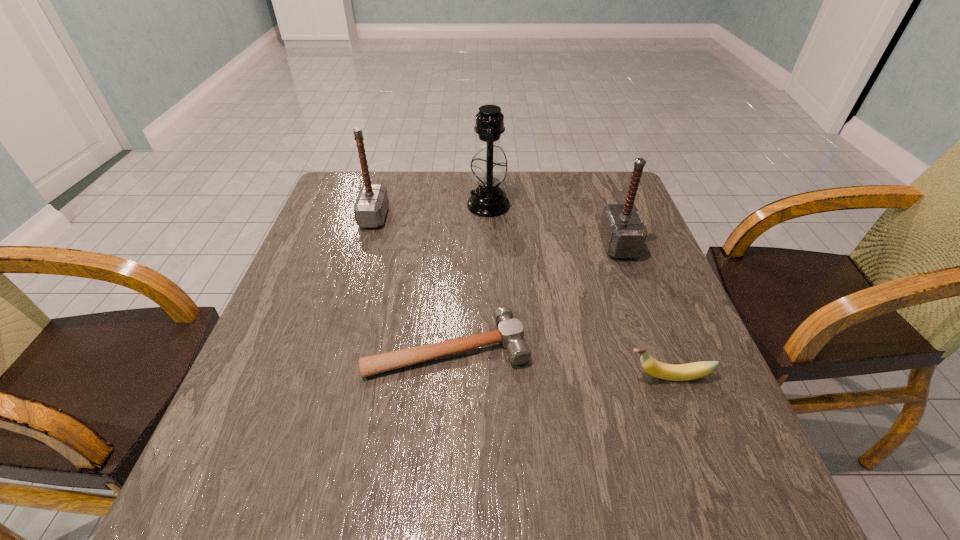
At what (x,y) coordinates should I click in order to perform the action: click on free space located 0.160m at the stem of the banana. Please return your answer as a coordinate pair (x, y). This screenshot has height=540, width=960. Looking at the image, I should click on (541, 376).

What are the coordinates of `free spot located at the stem of the banana` in the screenshot? It's located at (511, 376).

Find the location of `vacant region located on the right of the second hammer from right to left`. vacant region located on the right of the second hammer from right to left is located at coordinates (698, 346).

At what (x,y) coordinates should I click in order to perform the action: click on oil lamp at the far edge. Please return your answer as a coordinate pair (x, y). This screenshot has height=540, width=960. Looking at the image, I should click on (488, 167).

Identify the location of hammer that is at the far edge. (370, 208).

Find the location of a particular element. Image resolution: width=960 pixels, height=540 pixels. object that is at the left edge is located at coordinates (370, 208).

Where is `hammer that is at the right edge`? The image size is (960, 540). hammer that is at the right edge is located at coordinates (623, 232).

I want to click on banana at the right edge, so click(683, 372).

I want to click on object situated at the far left corner, so click(370, 208).

Image resolution: width=960 pixels, height=540 pixels. In the image, there is a desktop. What are the coordinates of `blank space at the far edge` in the screenshot? It's located at [433, 179].